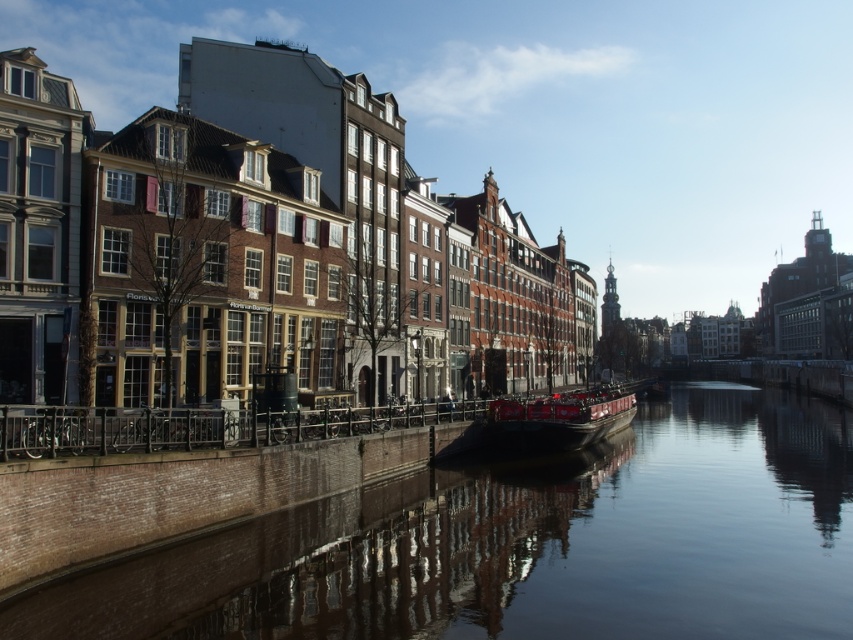
Question: Which of the following is the closest to the observer?

Choices:
 (A) smooth concrete canal at center
 (B) red wooden boat at center

Answer: (A)

Question: Which point is closer to the camera taking this photo?

Choices:
 (A) (540, 410)
 (B) (529, 509)

Answer: (B)

Question: Does smooth concrete canal at center have a greater width compared to red wooden boat at center?

Choices:
 (A) yes
 (B) no

Answer: (A)

Question: Among these objects, which one is nearest to the camera?

Choices:
 (A) smooth concrete canal at center
 (B) red wooden boat at center

Answer: (A)

Question: Does smooth concrete canal at center have a larger size compared to red wooden boat at center?

Choices:
 (A) no
 (B) yes

Answer: (B)

Question: Does smooth concrete canal at center lie behind red wooden boat at center?

Choices:
 (A) yes
 (B) no

Answer: (B)